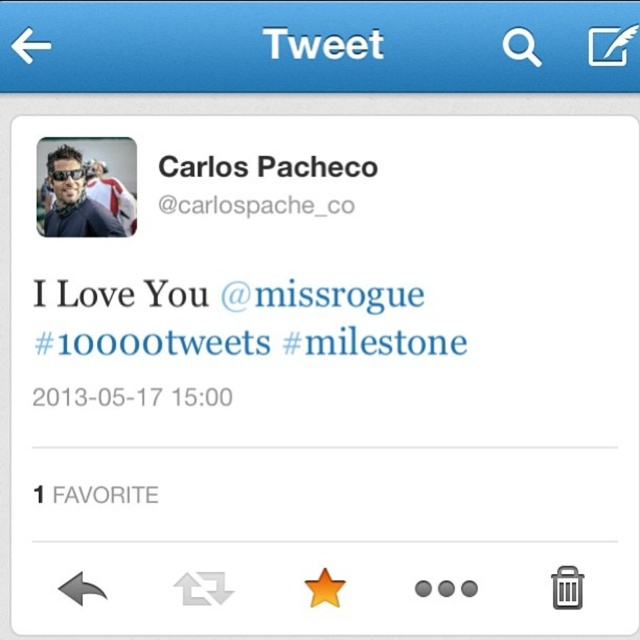
Does sunglasses at upper left appear under black text at upper center?

Correct, sunglasses at upper left is located below black text at upper center.

Does sunglasses at upper left appear on the left side of black text at upper center?

Indeed, sunglasses at upper left is positioned on the left side of black text at upper center.

Is point (72, 195) positioned after point (337, 170)?

No, (72, 195) is closer to viewer.

Find the location of a particular element. The width and height of the screenshot is (640, 640). sunglasses at upper left is located at coordinates (74, 198).

Does blue text tweet at center have a greater width compared to black text at upper center?

Correct, the width of blue text tweet at center exceeds that of black text at upper center.

Is point (188, 289) positioned after point (268, 161)?

Yes, point (188, 289) is behind point (268, 161).

Find the location of `blue text tweet at center`. blue text tweet at center is located at coordinates point(160,344).

Who is taller, blue text tweet at center or sunglasses at upper left?

sunglasses at upper left is taller.

Is blue text tweet at center above sunglasses at upper left?

No.

The image size is (640, 640). Find the location of `blue text tweet at center`. blue text tweet at center is located at coordinates (160, 344).

At what (x,y) coordinates should I click in order to perform the action: click on blue text tweet at center. Please return your answer as a coordinate pair (x, y). Image resolution: width=640 pixels, height=640 pixels. Looking at the image, I should click on (160, 344).